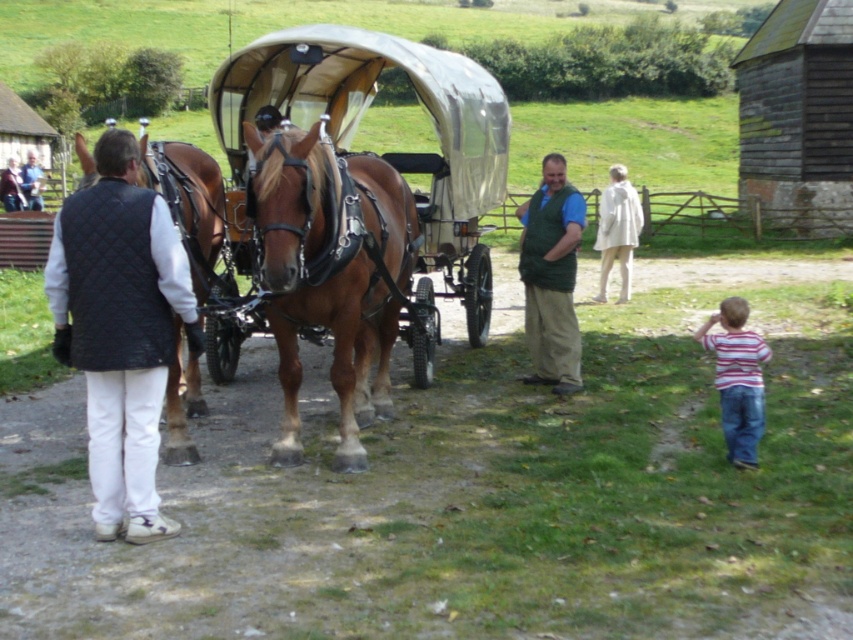
From the picture: You are a traveler looking to board the carriage. The driver is standing at point (550, 276). Where is the driver located relative to the carriage?

The driver is located at the point (550, 276), which is on the green quilted vest at center. Since the green quilted vest at center is part of the driver, the driver is positioned at the center of the carriage.

You are a passenger waiting to board the carriage and want to sit as close as possible to the horses. Which horse should you choose between the brown leather horse at center and the brown glossy horse at left?

You should choose the brown leather horse at center because the brown glossy horse at left is behind it, making the brown leather horse at center closer to the carriage where you would sit.